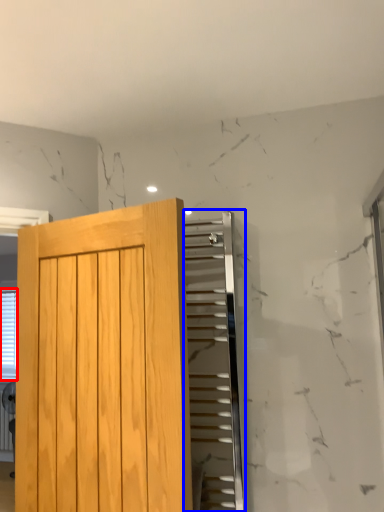
Question: Which object appears farthest to the camera in this image, blind (highlighted by a red box) or elevator (highlighted by a blue box)?

Choices:
 (A) blind
 (B) elevator

Answer: (A)